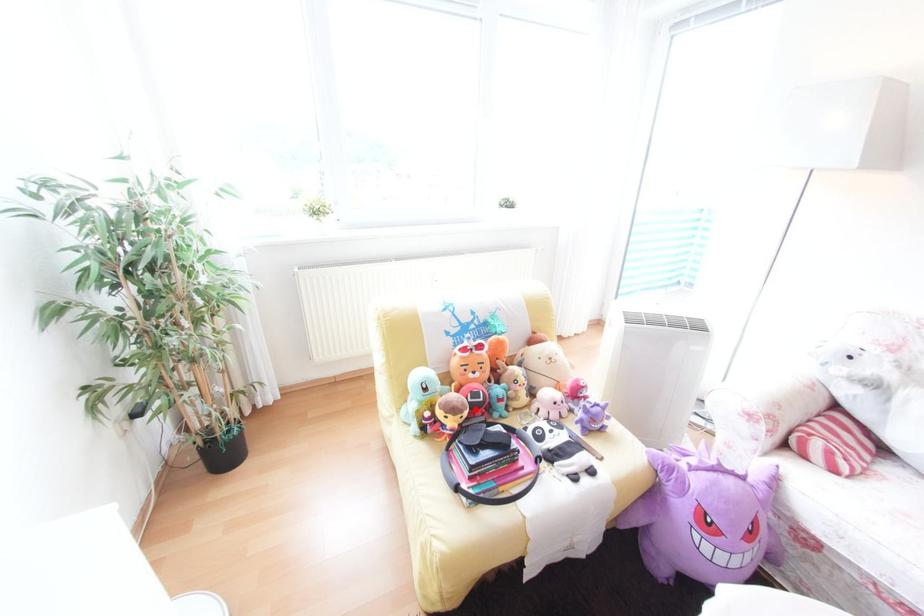
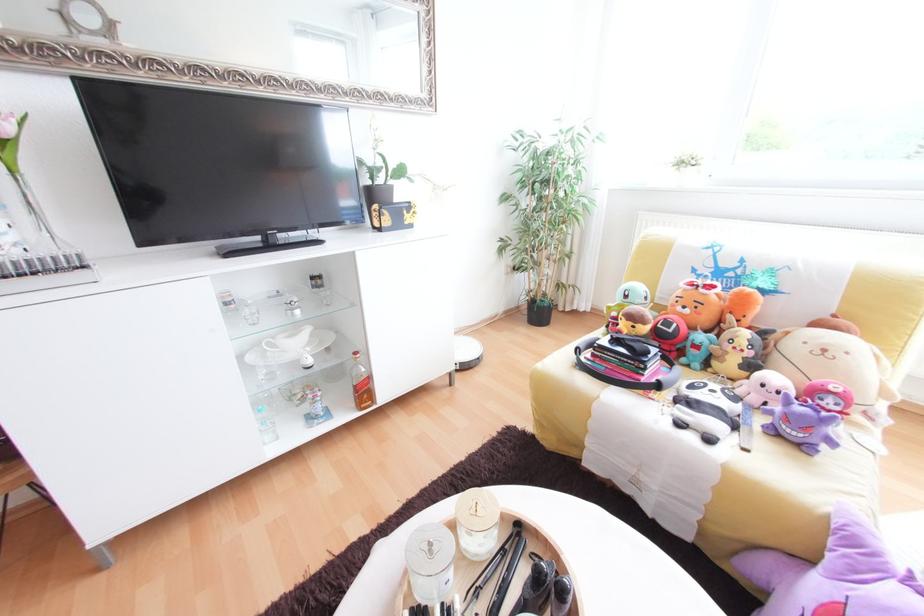
Find the pixel in the second image that matches the highlighted location in the first image.

(652, 323)